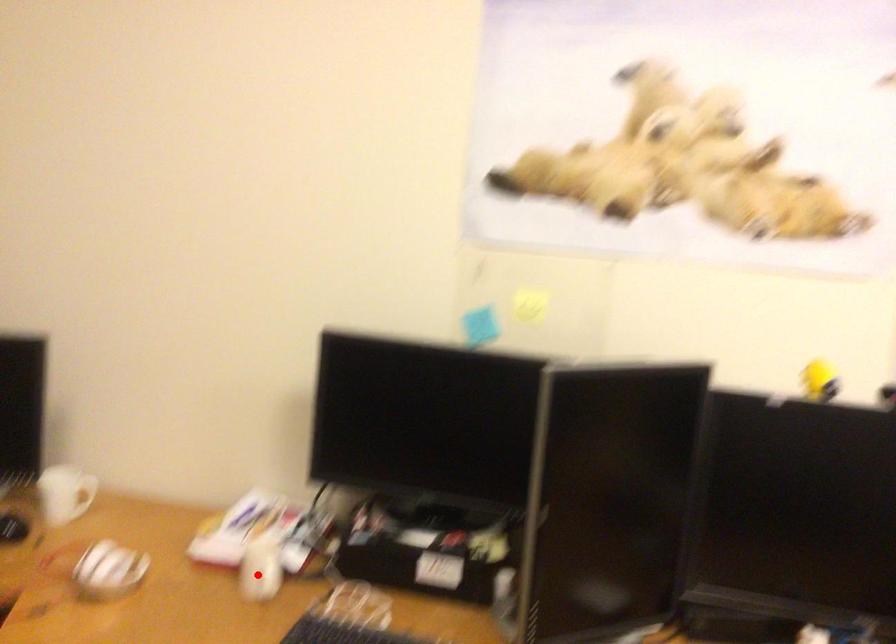
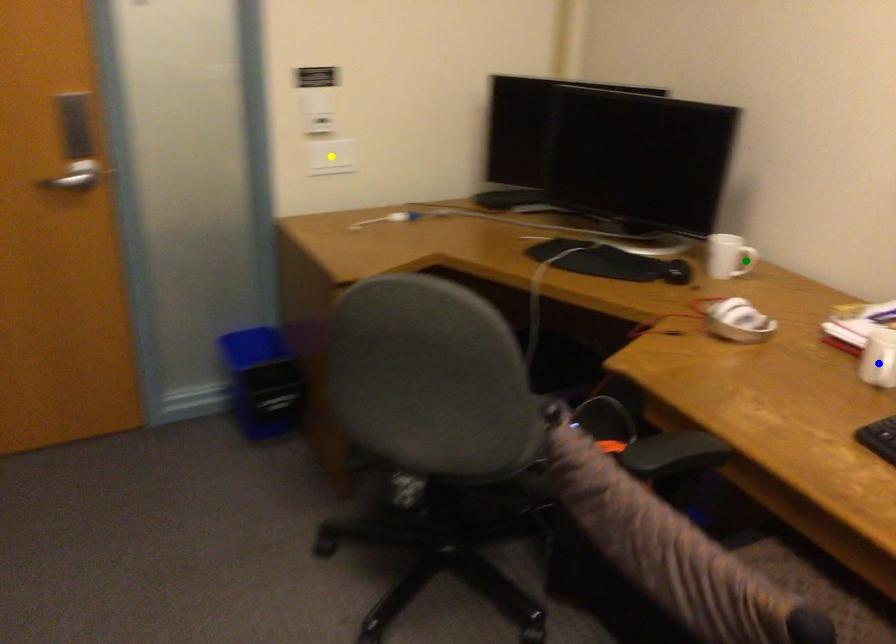
Question: I am providing you with two images of the same scene from different viewpoints. A red point is marked on the first image. You are given multiple points on the second image. Which mark in image 2 goes with the point in image 1?

Choices:
 (A) yellow point
 (B) blue point
 (C) green point

Answer: (B)